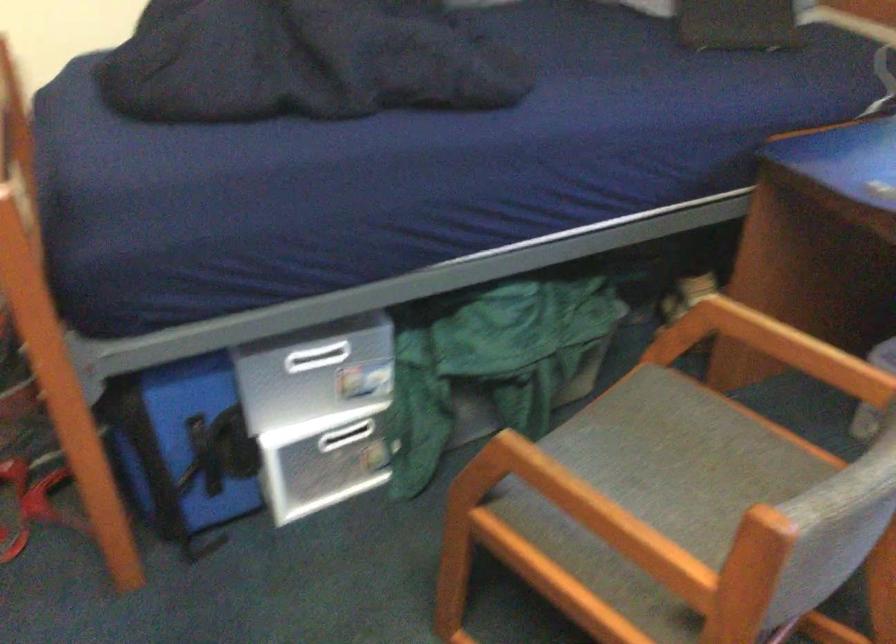
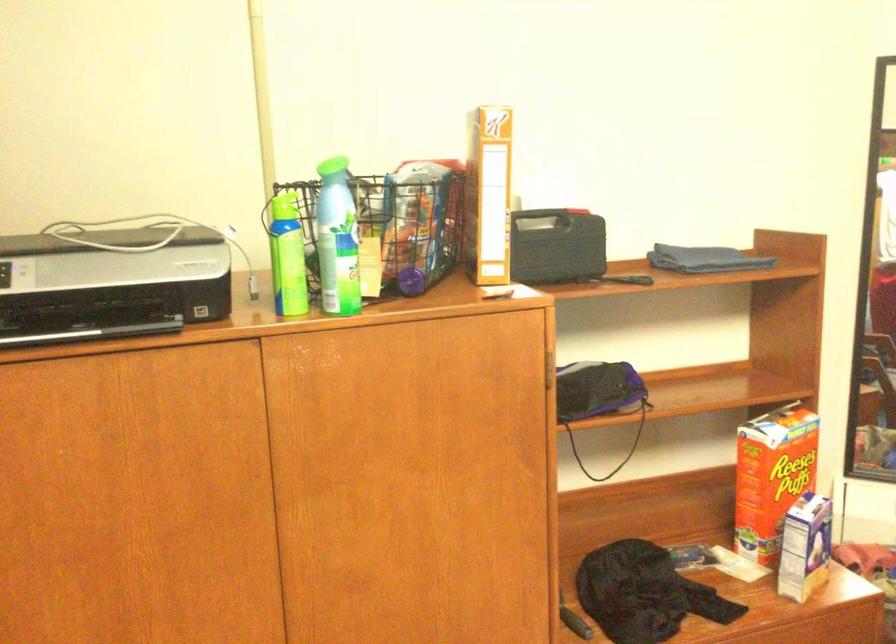
Question: Based on the continuous images, in which direction is the camera rotating? Reply with the corresponding letter.

Choices:
 (A) Left
 (B) Right
 (C) Up
 (D) Down

Answer: (A)